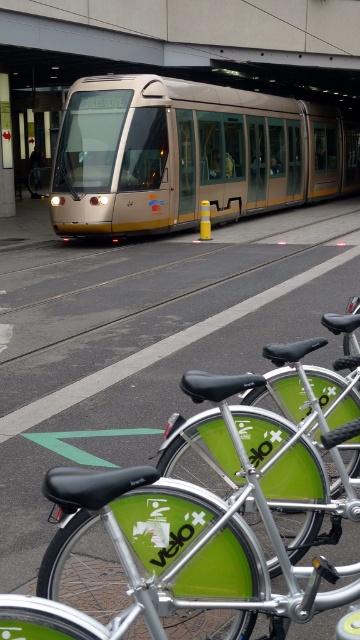
Which is more to the right, gold metallic train at center or green matte bicycle at center?

Positioned to the right is gold metallic train at center.

Can you confirm if gold metallic train at center is smaller than green matte bicycle at center?

Incorrect, gold metallic train at center is not smaller in size than green matte bicycle at center.

Where is `gold metallic train at center`? This screenshot has height=640, width=360. gold metallic train at center is located at coordinates (190, 154).

Is green metallic bicycle at lower center bigger than green matte bicycle at center?

Actually, green metallic bicycle at lower center might be smaller than green matte bicycle at center.

Between point (150, 577) and point (209, 330), which one is positioned in front?

Point (150, 577)

Find the location of a particular element. The height and width of the screenshot is (640, 360). green metallic bicycle at lower center is located at coordinates point(200,522).

Locate an element on the screen. The height and width of the screenshot is (640, 360). green metallic bicycle at lower center is located at coordinates (200, 522).

Can you confirm if green matte bicycle at lower center is positioned above green matte bicycle at center?

No.

Can you confirm if green matte bicycle at lower center is taller than green matte bicycle at center?

No.

Which is behind, point (327, 380) or point (56, 403)?

The point (56, 403) is more distant.

Identify the location of green matte bicycle at lower center. (312, 381).